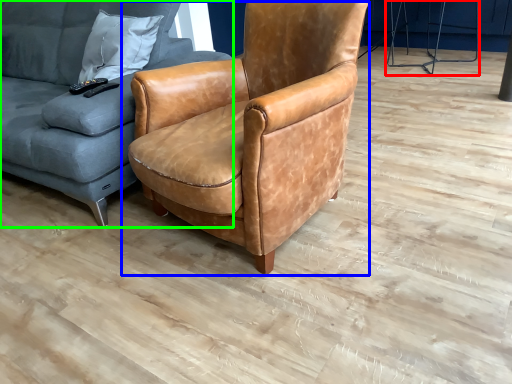
Question: Estimate the real-world distances between objects in this image. Which object is closer to half (highlighted by a red box), chair (highlighted by a blue box) or studio couch (highlighted by a green box)?

Choices:
 (A) chair
 (B) studio couch

Answer: (A)